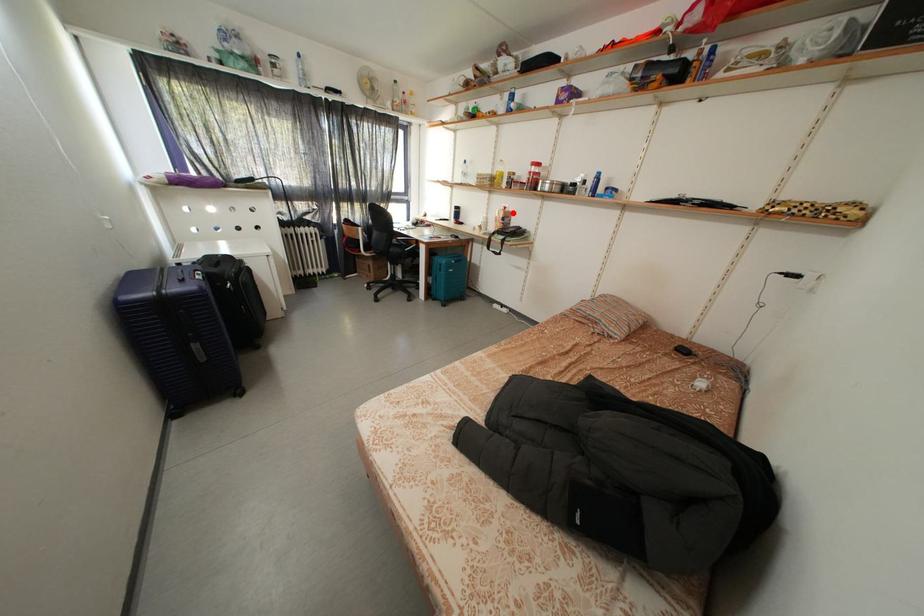
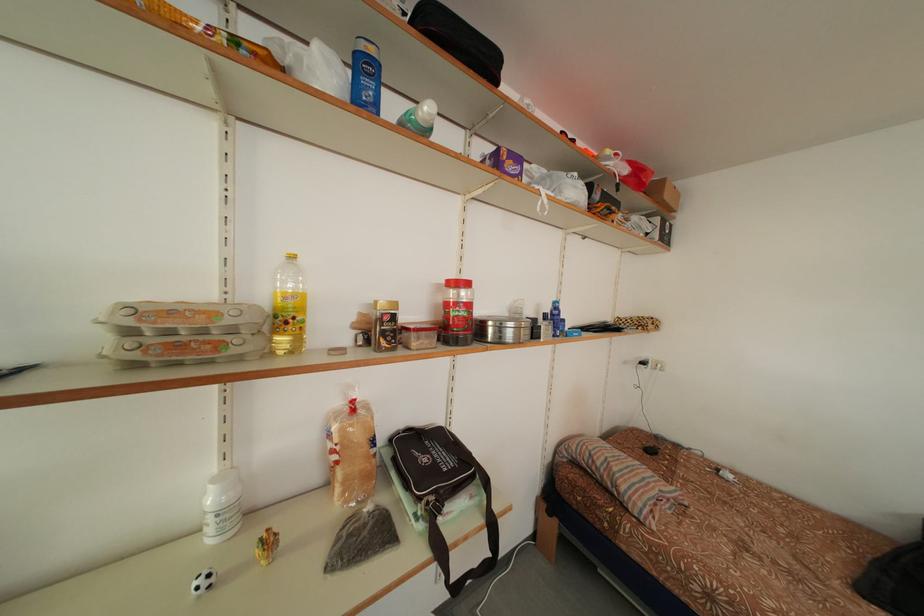
Question: I am providing you with two images of the same scene from different viewpoints. Image1 has a red point marked. In image2, the corresponding 3D location appears at what relative position? Reply with the corresponding letter.

Choices:
 (A) Closer
 (B) Farther

Answer: (B)